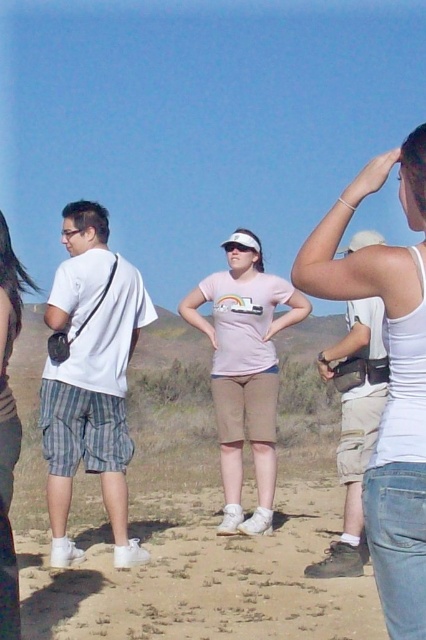
Does pink matte t-shirt at center have a larger size compared to matte white tank top at center?

No.

Describe the element at coordinates (244, 369) in the screenshot. This screenshot has height=640, width=426. I see `pink matte t-shirt at center` at that location.

Does point (264, 340) come in front of point (9, 605)?

No, it is not.

Locate an element on the screen. The width and height of the screenshot is (426, 640). pink matte t-shirt at center is located at coordinates (244, 369).

Is white tank top at upper right above matte white tank top at center?

Yes, white tank top at upper right is above matte white tank top at center.

Is point (417, 573) farther from camera compared to point (8, 547)?

That is False.

The height and width of the screenshot is (640, 426). I want to click on white tank top at upper right, so click(389, 376).

Where is `white tank top at upper right`? This screenshot has height=640, width=426. white tank top at upper right is located at coordinates (389, 376).

Which is more to the left, white tank top at upper right or khaki cargo shorts at right?

From the viewer's perspective, white tank top at upper right appears more on the left side.

Does white tank top at upper right appear on the left side of khaki cargo shorts at right?

Indeed, white tank top at upper right is positioned on the left side of khaki cargo shorts at right.

Which is in front, point (397, 369) or point (342, 547)?

Point (397, 369)

Where is `white tank top at upper right`? The height and width of the screenshot is (640, 426). white tank top at upper right is located at coordinates (389, 376).